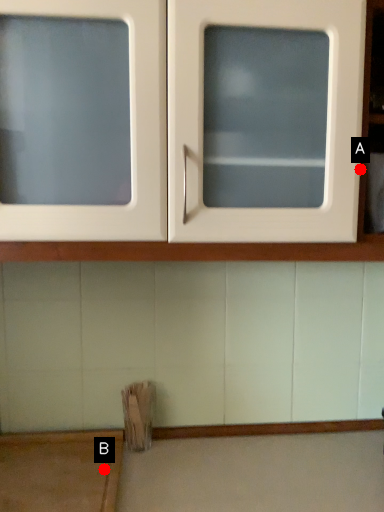
Question: Two points are circled on the image, labeled by A and B beside each circle. Which point appears closest to the camera in this image?

Choices:
 (A) A is closer
 (B) B is closer

Answer: (A)